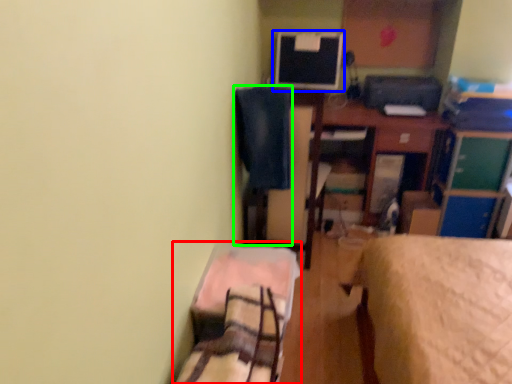
Question: Considering the real-world distances, which object is farthest from bed (highlighted by a red box)? computer monitor (highlighted by a blue box) or swivel chair (highlighted by a green box)?

Choices:
 (A) computer monitor
 (B) swivel chair

Answer: (A)